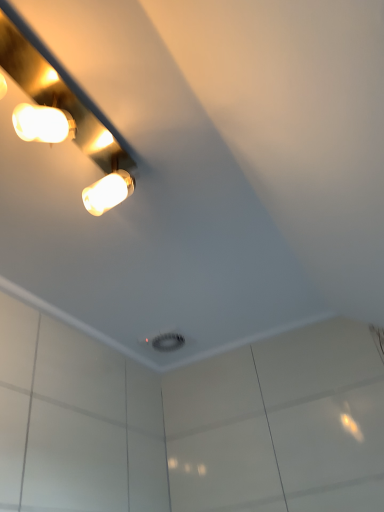
In order to face matte gold light fixture at upper left, should I rotate leftwards or rightwards?

You should look left and rotate roughly 17.584 degrees.

Describe the element at coordinates (68, 112) in the screenshot. I see `matte gold light fixture at upper left` at that location.

Locate an element on the screen. This screenshot has width=384, height=512. matte gold light fixture at upper left is located at coordinates click(x=68, y=112).

Locate an element on the screen. The width and height of the screenshot is (384, 512). matte gold light fixture at upper left is located at coordinates (68, 112).